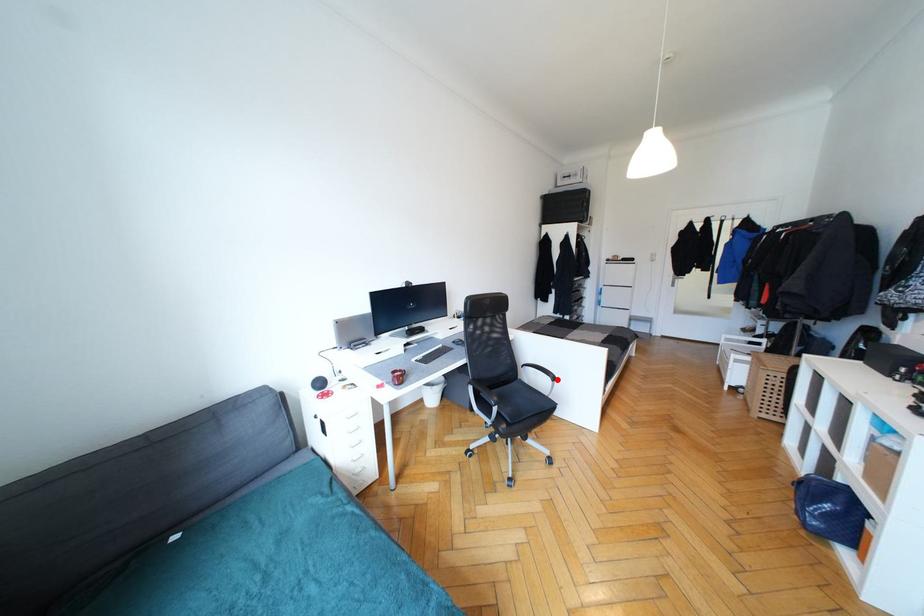
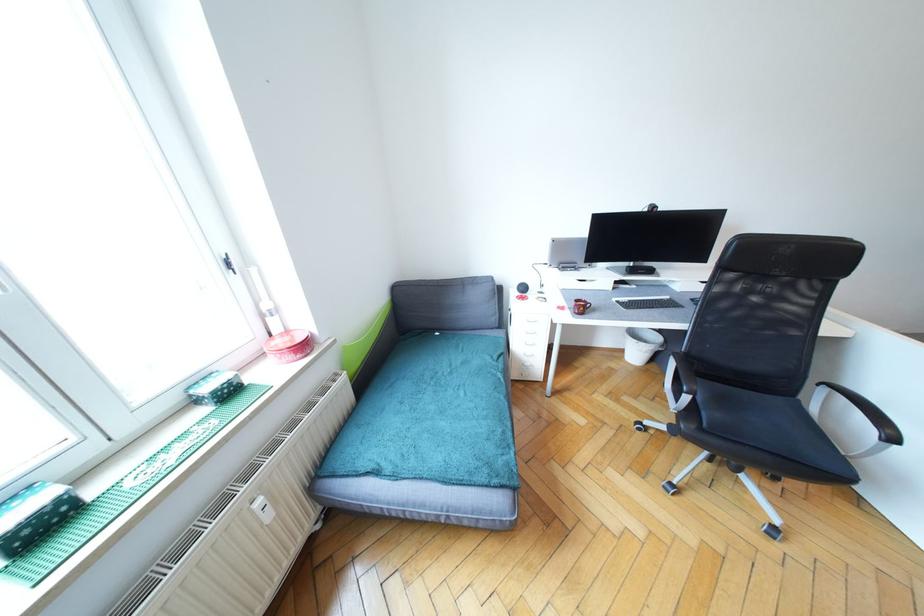
In the second image, find the point that corresponds to the highlighted location in the first image.

(896, 440)